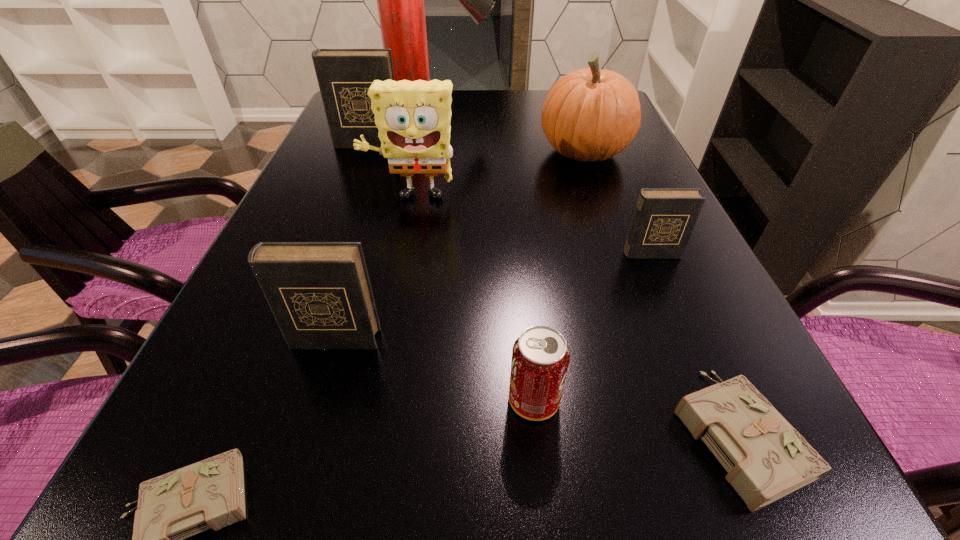
In the image, there is a desktop. Where is `vacant region at the far edge`? Image resolution: width=960 pixels, height=540 pixels. vacant region at the far edge is located at coordinates (534, 97).

In the image, there is a desktop. Where is `vacant space at the near edge`? Image resolution: width=960 pixels, height=540 pixels. vacant space at the near edge is located at coordinates (676, 501).

The height and width of the screenshot is (540, 960). Find the location of `vacant area at the left edge`. vacant area at the left edge is located at coordinates (315, 240).

This screenshot has height=540, width=960. What are the coordinates of `vacant space at the right edge of the desktop` in the screenshot? It's located at 667,364.

Locate an element on the screen. The width and height of the screenshot is (960, 540). free spot between the farthest dark diary and the second nearest dark diary is located at coordinates (510, 199).

Locate an element on the screen. The width and height of the screenshot is (960, 540). vacant space that is in between the tallest diary and the bigger green diary is located at coordinates (552, 289).

You are a GUI agent. You are given a task and a screenshot of the screen. Output one action in this format:
    pyautogui.click(x=<x>, y=<y>)
    Task: Click on the unoccupied area between the right green diary and the orange pumpkin
    
    Given the screenshot: What is the action you would take?
    pyautogui.click(x=660, y=293)

Where is `free area in between the pumpkin and the second shortest diary`? The height and width of the screenshot is (540, 960). free area in between the pumpkin and the second shortest diary is located at coordinates (660, 293).

Image resolution: width=960 pixels, height=540 pixels. I want to click on vacant space that is in between the tallest object and the third tallest diary, so click(544, 176).

In order to click on free space between the nearest dark diary and the fourth farthest object in this screenshot , I will do `click(372, 269)`.